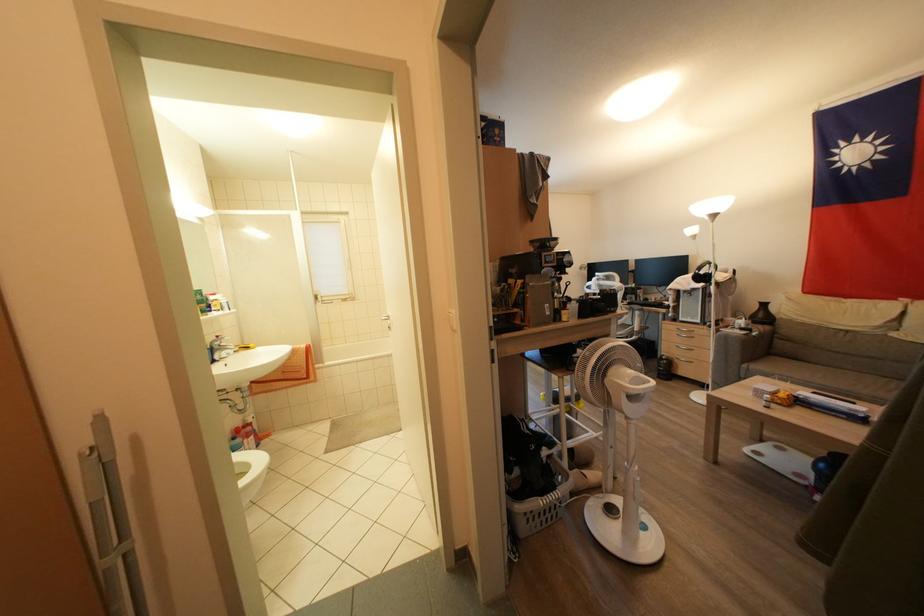
Image resolution: width=924 pixels, height=616 pixels. What are the coordinates of `faucet handle` in the screenshot? It's located at (219, 341).